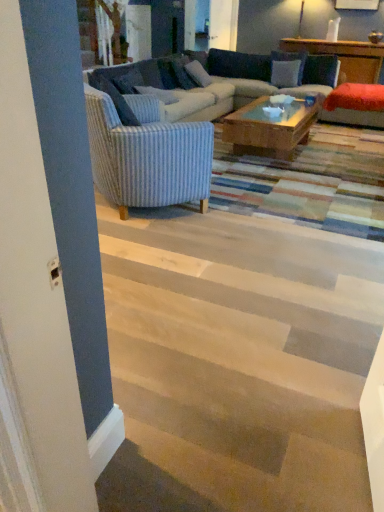
Question: From a real-world perspective, is blue striped pillow at upper left, marked as the fourth pillow in a right-to-left arrangement, beneath white fabric pillow at upper center, the 2th pillow viewed from the right?

Choices:
 (A) no
 (B) yes

Answer: (A)

Question: Is blue striped pillow at upper left, placed as the first pillow when sorted from left to right, surrounding white fabric pillow at upper center, the 2th pillow viewed from the right?

Choices:
 (A) no
 (B) yes

Answer: (A)

Question: Is blue striped pillow at upper left, placed as the first pillow when sorted from left to right, at the right side of white fabric pillow at upper center, marked as the third pillow in a left-to-right arrangement?

Choices:
 (A) no
 (B) yes

Answer: (A)

Question: Does blue striped pillow at upper left, placed as the first pillow when sorted from left to right, have a larger size compared to white fabric pillow at upper center, the 2th pillow viewed from the right?

Choices:
 (A) no
 (B) yes

Answer: (B)

Question: Is white fabric pillow at upper center, the 2th pillow viewed from the right, at the back of blue striped pillow at upper left, placed as the first pillow when sorted from left to right?

Choices:
 (A) no
 (B) yes

Answer: (A)

Question: Considering the relative sizes of blue striped pillow at upper left, marked as the fourth pillow in a right-to-left arrangement, and white fabric pillow at upper center, the 2th pillow viewed from the right, in the image provided, is blue striped pillow at upper left, marked as the fourth pillow in a right-to-left arrangement, smaller than white fabric pillow at upper center, the 2th pillow viewed from the right,?

Choices:
 (A) yes
 (B) no

Answer: (B)

Question: Is blue striped pillow at center, which is the third pillow from right to left, further to the viewer compared to striped fabric couch at center?

Choices:
 (A) no
 (B) yes

Answer: (B)

Question: Does blue striped pillow at center, which is the third pillow from right to left, have a greater height compared to striped fabric couch at center?

Choices:
 (A) no
 (B) yes

Answer: (A)

Question: Can you confirm if blue striped pillow at center, which is the third pillow from right to left, is shorter than striped fabric couch at center?

Choices:
 (A) yes
 (B) no

Answer: (A)

Question: Is blue striped pillow at center, which is the third pillow from right to left, oriented away from striped fabric couch at center?

Choices:
 (A) yes
 (B) no

Answer: (A)

Question: From the image's perspective, does blue striped pillow at center, the 2th pillow in the left-to-right sequence, appear lower than striped fabric couch at center?

Choices:
 (A) no
 (B) yes

Answer: (B)

Question: Is blue striped pillow at center, the 2th pillow in the left-to-right sequence, at the right side of striped fabric couch at center?

Choices:
 (A) yes
 (B) no

Answer: (B)

Question: Would you say striped fabric couch at center is part of blue striped pillow at upper left, placed as the first pillow when sorted from left to right,'s contents?

Choices:
 (A) yes
 (B) no

Answer: (B)